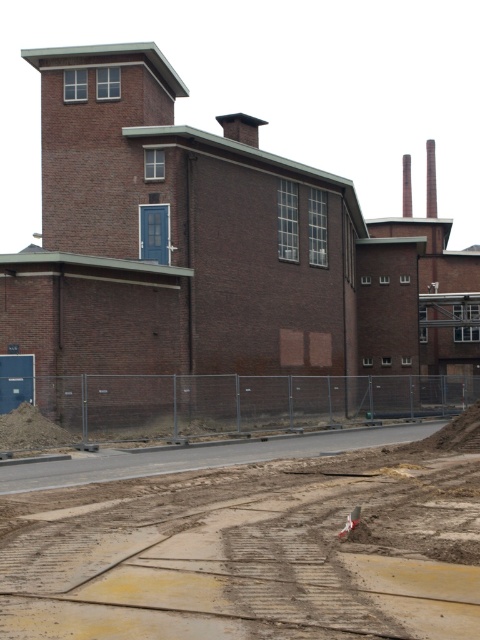
Question: Which point appears closest to the camera in this image?

Choices:
 (A) (213, 225)
 (B) (391, 513)

Answer: (B)

Question: Can you confirm if brown brick building at center is positioned to the right of brown dirt track at lower center?

Choices:
 (A) yes
 (B) no

Answer: (A)

Question: Where is brown brick building at center located in relation to brown dirt track at lower center in the image?

Choices:
 (A) below
 (B) above

Answer: (B)

Question: Which point is farther to the camera?

Choices:
 (A) brown dirt track at lower center
 (B) brown brick building at center

Answer: (B)

Question: Considering the relative positions of brown brick building at center and brown dirt track at lower center in the image provided, where is brown brick building at center located with respect to brown dirt track at lower center?

Choices:
 (A) below
 (B) above

Answer: (B)